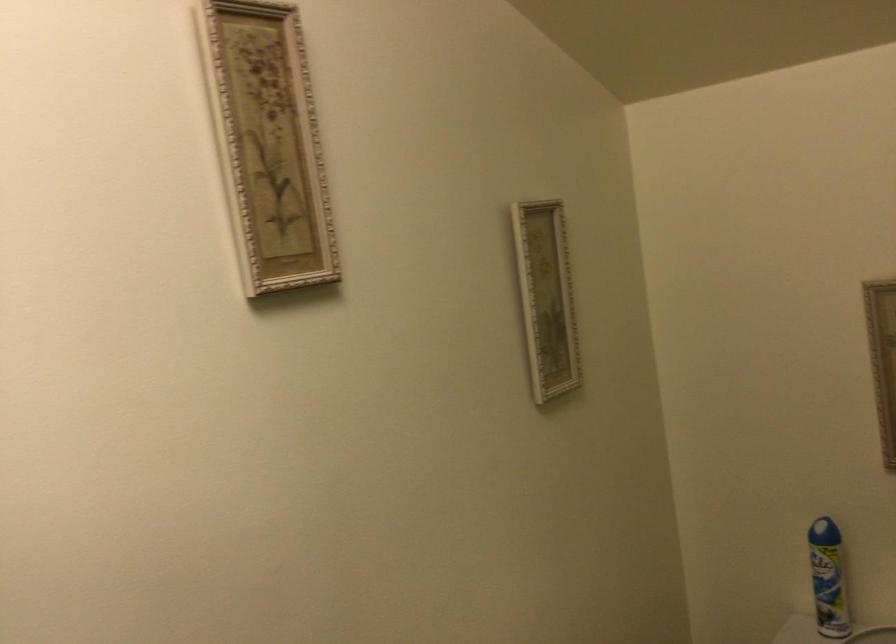
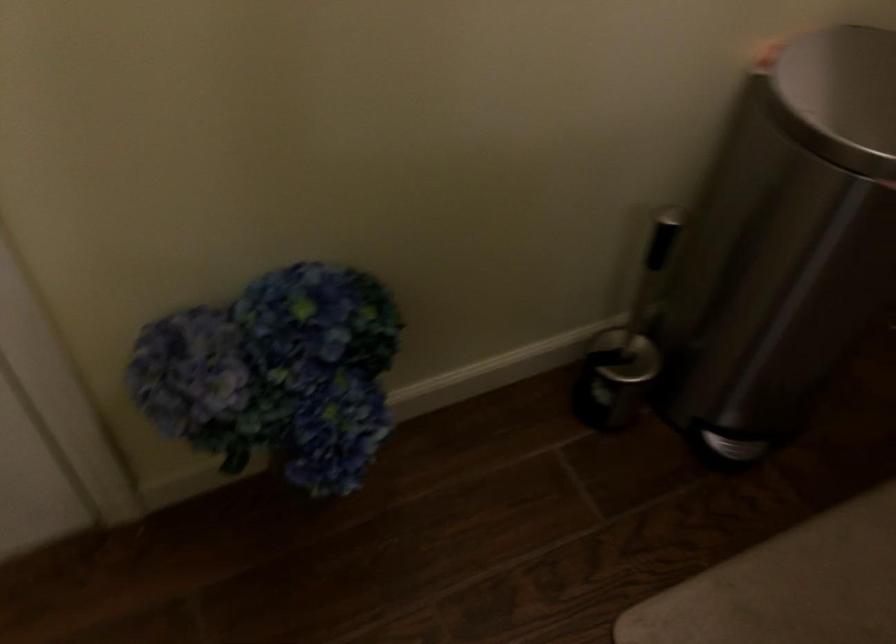
Question: The images are taken continuously from a first-person perspective. In which direction is your viewpoint rotating?

Choices:
 (A) Left
 (B) Right
 (C) Up
 (D) Down

Answer: (D)